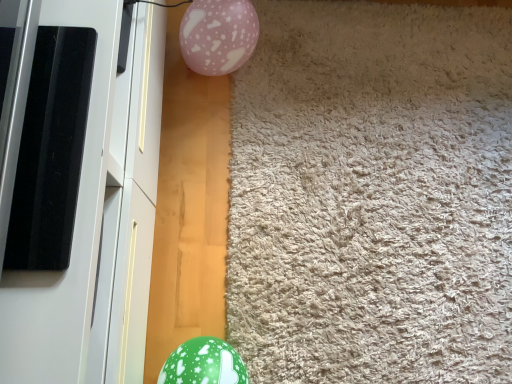
Question: Do you think beige shaggy carpet at center is within pink glossy balloon at upper center, or outside of it?

Choices:
 (A) inside
 (B) outside

Answer: (B)

Question: Considering the positions of beige shaggy carpet at center and pink glossy balloon at upper center in the image, is beige shaggy carpet at center bigger or smaller than pink glossy balloon at upper center?

Choices:
 (A) small
 (B) big

Answer: (B)

Question: Which is farther from the white glossy screen door at left?

Choices:
 (A) beige shaggy carpet at center
 (B) green glossy balloon at lower left
 (C) pink glossy balloon at upper center

Answer: (A)

Question: Estimate the real-world distances between objects in this image. Which object is closer to the beige shaggy carpet at center?

Choices:
 (A) pink glossy balloon at upper center
 (B) white glossy screen door at left
 (C) green glossy balloon at lower left

Answer: (A)